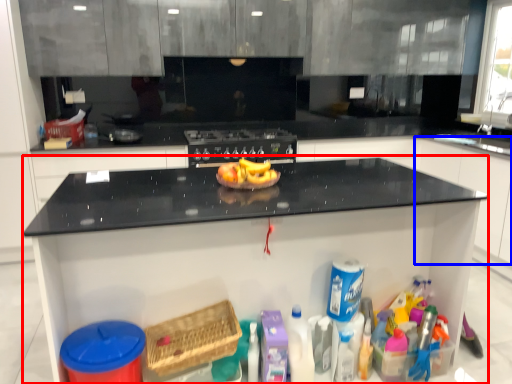
Question: Which object is closer to the camera taking this photo, countertop (highlighted by a red box) or cabinetry (highlighted by a blue box)?

Choices:
 (A) countertop
 (B) cabinetry

Answer: (A)